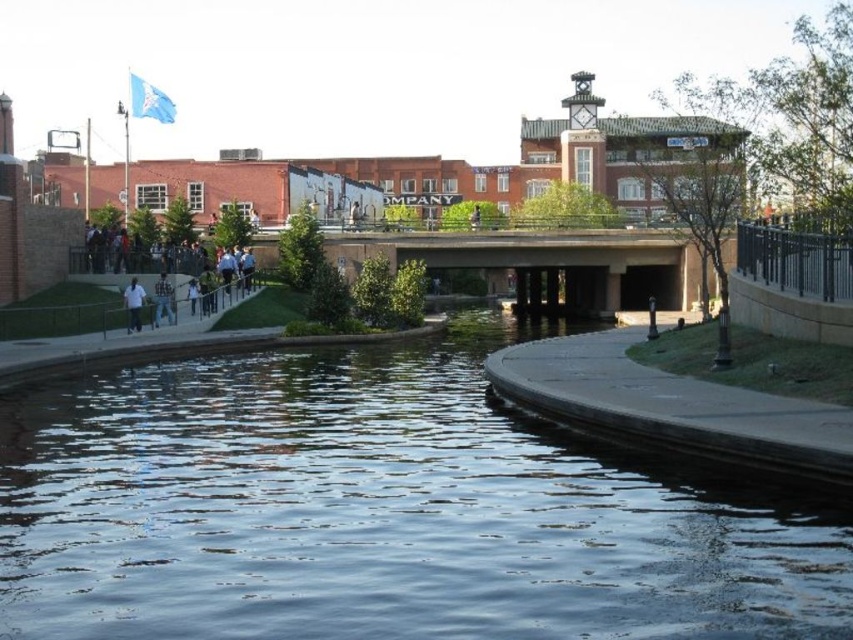
Question: Which of the following is the closest to the observer?

Choices:
 (A) concrete sidewalk at lower left
 (B) clear water at center
 (C) white cotton shirt at center
 (D) smooth concrete path at lower right

Answer: (B)

Question: Can you confirm if clear water at center is smaller than concrete sidewalk at lower left?

Choices:
 (A) yes
 (B) no

Answer: (B)

Question: Is smooth concrete path at lower right above white matte shirt at lower left?

Choices:
 (A) no
 (B) yes

Answer: (A)

Question: Which object is farther from the camera taking this photo?

Choices:
 (A) clear water at center
 (B) smooth concrete path at lower right
 (C) concrete sidewalk at lower left

Answer: (C)

Question: Which object appears closest to the camera in this image?

Choices:
 (A) concrete sidewalk at lower left
 (B) clear water at center
 (C) smooth concrete path at lower right

Answer: (B)

Question: Can you confirm if smooth concrete path at lower right is positioned to the left of concrete sidewalk at lower left?

Choices:
 (A) no
 (B) yes

Answer: (A)